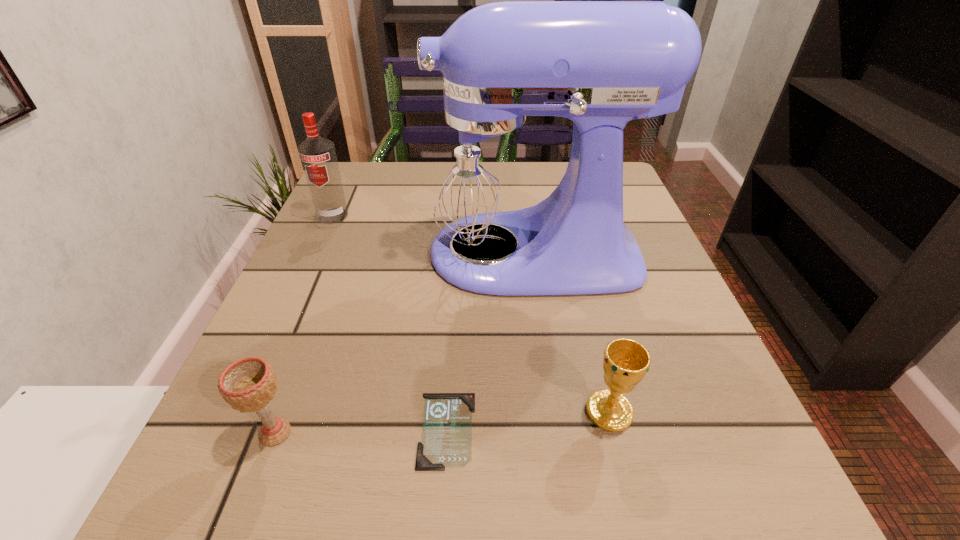
You are a GUI agent. You are given a task and a screenshot of the screen. Output one action in this format:
    pyautogui.click(x=<x>, y=<y>)
    Task: Click on the free space at the near edge of the desktop
    This screenshot has width=960, height=540.
    Given the screenshot: What is the action you would take?
    pyautogui.click(x=366, y=517)

The width and height of the screenshot is (960, 540). Find the location of `vacant space at the left edge of the desktop`. vacant space at the left edge of the desktop is located at coordinates (299, 276).

Find the location of a particular element. This screenshot has height=540, width=960. free location at the right edge of the desktop is located at coordinates (612, 324).

Where is `free space at the far left corner of the desktop`? This screenshot has width=960, height=540. free space at the far left corner of the desktop is located at coordinates (343, 171).

Find the location of a particular element. This screenshot has width=960, height=540. vacant space at the near left corner of the desktop is located at coordinates (276, 496).

What are the coordinates of `vacant space that's between the identity card and the left chalice` in the screenshot? It's located at tap(361, 431).

Locate an element on the screen. This screenshot has width=960, height=540. vacant space that's between the identity card and the right chalice is located at coordinates (528, 421).

This screenshot has height=540, width=960. In order to click on vacant space that's between the tallest object and the fourth shortest object in this screenshot , I will do `click(430, 234)`.

Locate an element on the screen. vacant area between the vodka and the left chalice is located at coordinates (304, 324).

What are the coordinates of `vacant area between the tallest object and the left chalice` in the screenshot? It's located at (401, 343).